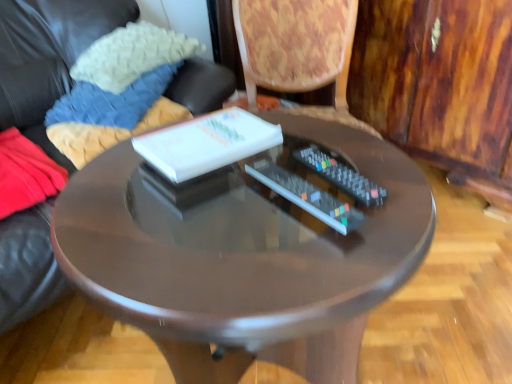
At what (x,y) coordinates should I click in order to perform the action: click on white glossy book at center. Please return your answer as a coordinate pair (x, y). Image resolution: width=512 pixels, height=384 pixels. Looking at the image, I should click on (206, 143).

You are a GUI agent. You are given a task and a screenshot of the screen. Output one action in this format:
    pyautogui.click(x=<x>, y=<y>)
    Task: Click on the glossy wood table at center
    The image size is (512, 384).
    Given the screenshot: What is the action you would take?
    pyautogui.click(x=246, y=257)

The width and height of the screenshot is (512, 384). Identify the location of white knitted pillow at upper left, which is the 1th pillow in top-to-bottom order. (131, 55).

What do you see at coordinates (131, 55) in the screenshot? Image resolution: width=512 pixels, height=384 pixels. I see `white knitted pillow at upper left, the 2th pillow from the bottom` at bounding box center [131, 55].

Where is `black plastic remote at center, which appears as the first remote control when viewed from the right`? This screenshot has width=512, height=384. black plastic remote at center, which appears as the first remote control when viewed from the right is located at coordinates (341, 176).

In order to face matte black remote control at center, positioned as the second remote control in right-to-left order, should I rotate leftwards or rightwards?

You should rotate right by 5.759 degrees.

You are a GUI agent. You are given a task and a screenshot of the screen. Output one action in this format:
    pyautogui.click(x=<x>, y=<y>)
    Task: Click on the soft woolen pillow at upper left, the first pillow from the bottom
    This screenshot has height=384, width=512.
    Given the screenshot: What is the action you would take?
    pyautogui.click(x=109, y=132)

You are a GUI agent. You are given a task and a screenshot of the screen. Output one action in this format:
    pyautogui.click(x=<x>, y=<y>)
    Task: Click on the white glossy book at center
    
    Given the screenshot: What is the action you would take?
    pyautogui.click(x=206, y=143)

Which of these two, white knitted pillow at upper left, the 2th pillow from the bottom, or soft woolen pillow at upper left, which is counted as the 2th pillow, starting from the top, stands shorter?

soft woolen pillow at upper left, which is counted as the 2th pillow, starting from the top, is shorter.

Is white knitted pillow at upper left, which is the 1th pillow in top-to-bottom order, looking in the opposite direction of soft woolen pillow at upper left, which is counted as the 2th pillow, starting from the top?

No, white knitted pillow at upper left, which is the 1th pillow in top-to-bottom order, is not facing the opposite direction of soft woolen pillow at upper left, which is counted as the 2th pillow, starting from the top.

Can you tell me how much white knitted pillow at upper left, the 2th pillow from the bottom, and soft woolen pillow at upper left, which is counted as the 2th pillow, starting from the top, differ in facing direction?

They differ by 0.0621 degrees in their facing directions.

Between white knitted pillow at upper left, the 2th pillow from the bottom, and soft woolen pillow at upper left, the first pillow from the bottom, which one appears on the left side from the viewer's perspective?

soft woolen pillow at upper left, the first pillow from the bottom.

Consider the image. Is matte black remote control at center, the first remote control positioned from the left, a part of glossy wood table at center?

Yes, matte black remote control at center, the first remote control positioned from the left, is inside glossy wood table at center.

Is glossy wood table at center positioned before matte black remote control at center, positioned as the second remote control in right-to-left order?

Yes, it is.

From the picture: Is glossy wood table at center aimed at matte black remote control at center, positioned as the second remote control in right-to-left order?

No, glossy wood table at center is not facing towards matte black remote control at center, positioned as the second remote control in right-to-left order.

Is glossy wood table at center far from white glossy book at center?

No, glossy wood table at center is in close proximity to white glossy book at center.

Is glossy wood table at center taller or shorter than white glossy book at center?

In the image, glossy wood table at center appears to be taller than white glossy book at center.

From a real-world perspective, which is physically below, glossy wood table at center or white glossy book at center?

glossy wood table at center, from a real-world perspective.

Measure the distance from white glossy book at center to soft woolen pillow at upper left, the first pillow from the bottom.

white glossy book at center is 18.91 inches from soft woolen pillow at upper left, the first pillow from the bottom.

Locate an element on the screen. pillow that is the 1st one when counting backward from the white glossy book at center is located at coordinates (109, 132).

In terms of height, does white glossy book at center look taller or shorter compared to soft woolen pillow at upper left, the first pillow from the bottom?

Clearly, white glossy book at center is shorter compared to soft woolen pillow at upper left, the first pillow from the bottom.

From the image's perspective, which is below, white glossy book at center or soft woolen pillow at upper left, the first pillow from the bottom?

white glossy book at center appears lower in the image.

Is point (155, 147) positioned before point (302, 150)?

Yes, point (155, 147) is closer to viewer.

Considering the sizes of objects white glossy book at center and black plastic remote at center, which is the second remote control from left to right, in the image provided, who is shorter, white glossy book at center or black plastic remote at center, which is the second remote control from left to right,?

black plastic remote at center, which is the second remote control from left to right, is shorter.

Can you tell me how much white glossy book at center and black plastic remote at center, which appears as the first remote control when viewed from the right, differ in facing direction?

8.68 degrees.

Between white glossy book at center and black plastic remote at center, which is the second remote control from left to right, which one has larger width?

With larger width is black plastic remote at center, which is the second remote control from left to right.

Can you tell me how much white knitted pillow at upper left, the 2th pillow from the bottom, and matte black remote control at center, positioned as the second remote control in right-to-left order, differ in facing direction?

There is a 8.02-degree angle between the facing directions of white knitted pillow at upper left, the 2th pillow from the bottom, and matte black remote control at center, positioned as the second remote control in right-to-left order.

Is the position of white knitted pillow at upper left, the 2th pillow from the bottom, less distant than that of matte black remote control at center, positioned as the second remote control in right-to-left order?

That is False.

Can you confirm if white knitted pillow at upper left, the 2th pillow from the bottom, is bigger than matte black remote control at center, the first remote control positioned from the left?

Correct, white knitted pillow at upper left, the 2th pillow from the bottom, is larger in size than matte black remote control at center, the first remote control positioned from the left.

Which of these two, matte black remote control at center, positioned as the second remote control in right-to-left order, or glossy wood table at center, stands taller?

glossy wood table at center is taller.

From a real-world perspective, which is physically above, matte black remote control at center, positioned as the second remote control in right-to-left order, or glossy wood table at center?

In real-world perspective, matte black remote control at center, positioned as the second remote control in right-to-left order, is above.

Between matte black remote control at center, positioned as the second remote control in right-to-left order, and glossy wood table at center, which one has smaller size?

matte black remote control at center, positioned as the second remote control in right-to-left order, is smaller.

From the image's perspective, count 1st remote controls upward from the glossy wood table at center and point to it. Please provide its 2D coordinates.

[(307, 196)]

The image size is (512, 384). I want to click on pillow that is on the right side of soft woolen pillow at upper left, which is counted as the 2th pillow, starting from the top, so click(131, 55).

Locate an element on the screen. The height and width of the screenshot is (384, 512). table below the matte black remote control at center, the first remote control positioned from the left (from the image's perspective) is located at coordinates (246, 257).

From the image, which object appears to be nearer to black plastic remote at center, which is the second remote control from left to right, soft woolen pillow at upper left, the first pillow from the bottom, or white glossy book at center?

white glossy book at center is positioned closer to the anchor black plastic remote at center, which is the second remote control from left to right.

Based on their spatial positions, is soft woolen pillow at upper left, which is counted as the 2th pillow, starting from the top, or black plastic remote at center, which is the second remote control from left to right, further from white knitted pillow at upper left, which is the 1th pillow in top-to-bottom order?

black plastic remote at center, which is the second remote control from left to right, lies further to white knitted pillow at upper left, which is the 1th pillow in top-to-bottom order, than the other object.

Which object lies nearer to the anchor point white glossy book at center, glossy wood table at center or soft woolen pillow at upper left, the first pillow from the bottom?

Among the two, glossy wood table at center is located nearer to white glossy book at center.

Based on their spatial positions, is white knitted pillow at upper left, the 2th pillow from the bottom, or matte black remote control at center, positioned as the second remote control in right-to-left order, closer to soft woolen pillow at upper left, the first pillow from the bottom?

white knitted pillow at upper left, the 2th pillow from the bottom, lies closer to soft woolen pillow at upper left, the first pillow from the bottom, than the other object.

From the image, which object appears to be nearer to white glossy book at center, white knitted pillow at upper left, the 2th pillow from the bottom, or glossy wood table at center?

Among the two, glossy wood table at center is located nearer to white glossy book at center.

Looking at the image, which one is located closer to glossy wood table at center, white glossy book at center or matte black remote control at center, the first remote control positioned from the left?

white glossy book at center is closer to glossy wood table at center.

Estimate the real-world distances between objects in this image. Which object is closer to white knitted pillow at upper left, the 2th pillow from the bottom, matte black remote control at center, the first remote control positioned from the left, or soft woolen pillow at upper left, which is counted as the 2th pillow, starting from the top?

The object closer to white knitted pillow at upper left, the 2th pillow from the bottom, is soft woolen pillow at upper left, which is counted as the 2th pillow, starting from the top.

Estimate the real-world distances between objects in this image. Which object is further from white glossy book at center, soft woolen pillow at upper left, the first pillow from the bottom, or white knitted pillow at upper left, the 2th pillow from the bottom?

white knitted pillow at upper left, the 2th pillow from the bottom, is further to white glossy book at center.

Identify the location of remote control between matte black remote control at center, the first remote control positioned from the left, and white knitted pillow at upper left, which is the 1th pillow in top-to-bottom order, in the front-back direction. The image size is (512, 384). (341, 176).

Identify the location of book located between soft woolen pillow at upper left, the first pillow from the bottom, and black plastic remote at center, which is the second remote control from left to right, in the left-right direction. (206, 143).

I want to click on pillow positioned between matte black remote control at center, positioned as the second remote control in right-to-left order, and white knitted pillow at upper left, the 2th pillow from the bottom, from near to far, so click(x=109, y=132).

Identify the location of book situated between soft woolen pillow at upper left, which is counted as the 2th pillow, starting from the top, and matte black remote control at center, the first remote control positioned from the left, from left to right. This screenshot has height=384, width=512. (206, 143).